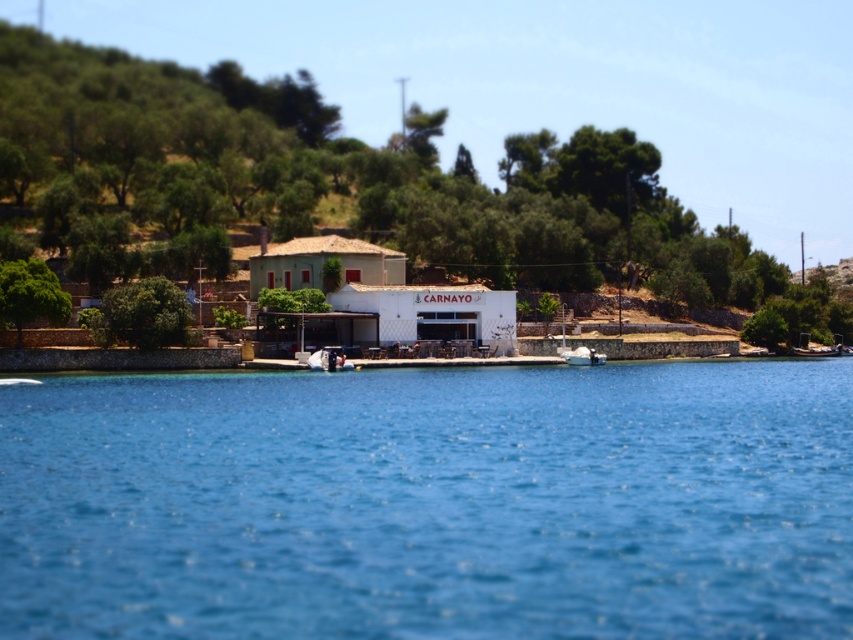
Question: Among these objects, which one is farthest from the camera?

Choices:
 (A) blue water at center
 (B) white matte boat at center

Answer: (B)

Question: Can you confirm if green grassy hillside at upper left is smaller than white matte boat at center?

Choices:
 (A) yes
 (B) no

Answer: (B)

Question: Is green grassy hillside at upper left to the left of white matte boat at center from the viewer's perspective?

Choices:
 (A) no
 (B) yes

Answer: (B)

Question: Among these objects, which one is nearest to the camera?

Choices:
 (A) blue water at center
 (B) green grassy hillside at upper left
 (C) white matte boat at center

Answer: (A)

Question: Is green grassy hillside at upper left positioned at the back of white matte boat at center?

Choices:
 (A) no
 (B) yes

Answer: (B)

Question: Among these objects, which one is nearest to the camera?

Choices:
 (A) blue water at center
 (B) white matte boat at center
 (C) green grassy hillside at upper left

Answer: (A)